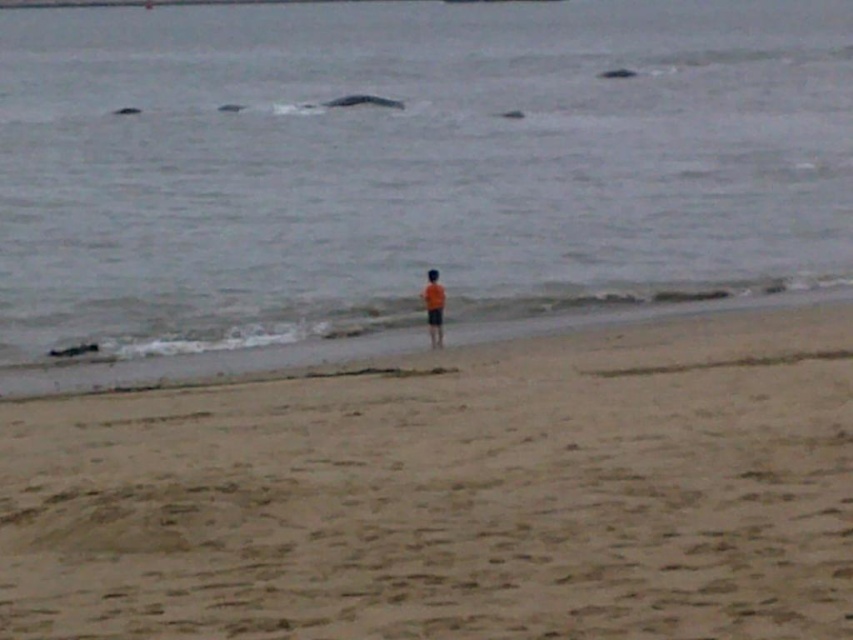
Question: Which point appears closest to the camera in this image?

Choices:
 (A) (433, 308)
 (B) (270, 564)
 (C) (384, 164)

Answer: (B)

Question: Can you confirm if light brown sand at center is positioned to the right of orange fabric person at center?

Choices:
 (A) yes
 (B) no

Answer: (B)

Question: Which object is positioned closest to the orange fabric person at center?

Choices:
 (A) light brown sand at center
 (B) gray matte water at center

Answer: (A)

Question: Does gray matte water at center appear under orange fabric person at center?

Choices:
 (A) yes
 (B) no

Answer: (B)

Question: Does gray matte water at center have a smaller size compared to light brown sand at center?

Choices:
 (A) yes
 (B) no

Answer: (B)

Question: Which object is farther from the camera taking this photo?

Choices:
 (A) orange fabric person at center
 (B) light brown sand at center

Answer: (A)